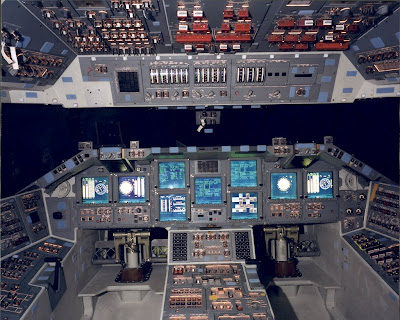
Where is `blue wall`? This screenshot has width=400, height=320. blue wall is located at coordinates (279, 128), (160, 132).